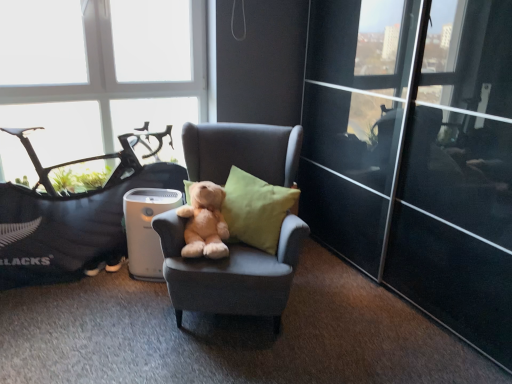
Question: Is transparent glass window at upper left positioned beyond the bounds of soft gray bean bag chair at left?

Choices:
 (A) yes
 (B) no

Answer: (A)

Question: Is transparent glass window at upper left shorter than soft gray bean bag chair at left?

Choices:
 (A) yes
 (B) no

Answer: (B)

Question: From a real-world perspective, does transparent glass window at upper left stand above soft gray bean bag chair at left?

Choices:
 (A) no
 (B) yes

Answer: (B)

Question: Is the surface of transparent glass window at upper left in direct contact with soft gray bean bag chair at left?

Choices:
 (A) no
 (B) yes

Answer: (A)

Question: Could you tell me if transparent glass window at upper left is turned towards soft gray bean bag chair at left?

Choices:
 (A) yes
 (B) no

Answer: (A)

Question: From a real-world perspective, is transparent glass window at upper left beneath soft gray bean bag chair at left?

Choices:
 (A) yes
 (B) no

Answer: (B)

Question: Can you confirm if soft plush teddy bear at center is smaller than transparent glass door at right?

Choices:
 (A) no
 (B) yes

Answer: (B)

Question: Is soft plush teddy bear at center outside transparent glass door at right?

Choices:
 (A) no
 (B) yes

Answer: (B)

Question: Is transparent glass door at right completely or partially inside soft plush teddy bear at center?

Choices:
 (A) yes
 (B) no

Answer: (B)

Question: Does soft plush teddy bear at center have a greater width compared to transparent glass door at right?

Choices:
 (A) yes
 (B) no

Answer: (B)

Question: Does soft plush teddy bear at center touch transparent glass door at right?

Choices:
 (A) yes
 (B) no

Answer: (B)

Question: From the image's perspective, is soft plush teddy bear at center located above transparent glass door at right?

Choices:
 (A) no
 (B) yes

Answer: (A)

Question: Considering the relative sizes of transparent glass window at upper left and soft plush teddy bear at center in the image provided, is transparent glass window at upper left bigger than soft plush teddy bear at center?

Choices:
 (A) yes
 (B) no

Answer: (A)